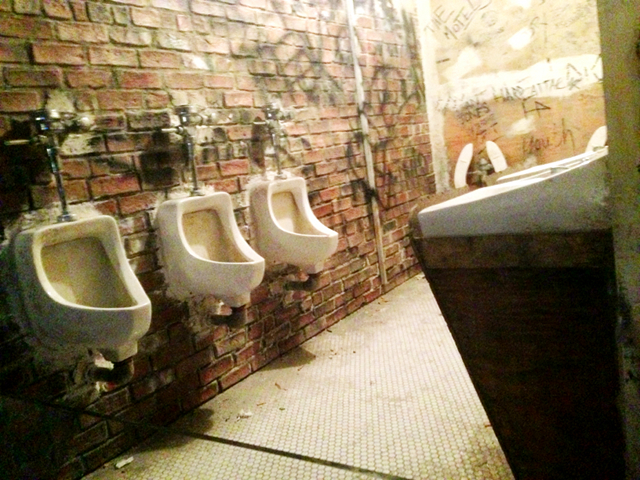
Where is `urinals`? The image size is (640, 480). urinals is located at coordinates (84, 300), (235, 262), (312, 234).